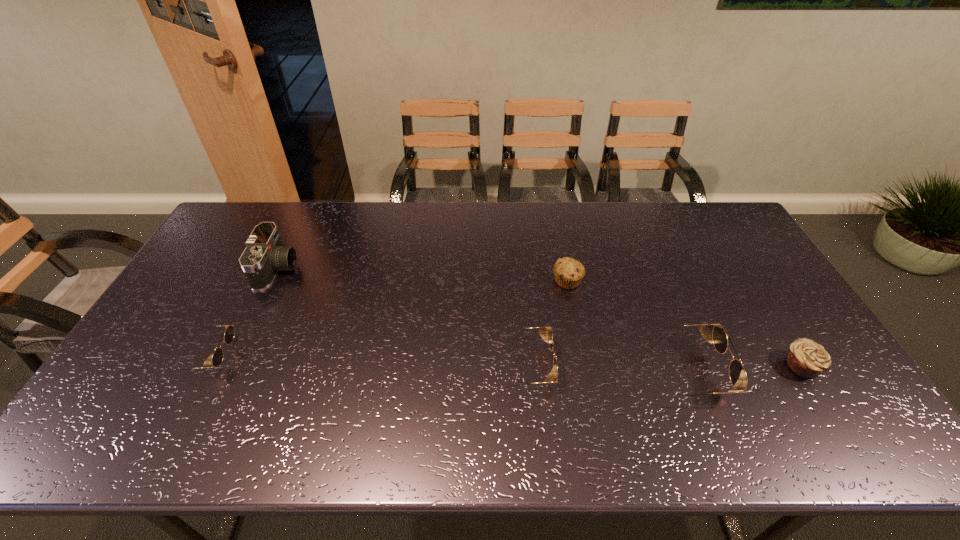
The width and height of the screenshot is (960, 540). Find the location of `vacant position for inserting another sunglasses evenly`. vacant position for inserting another sunglasses evenly is located at coordinates (364, 361).